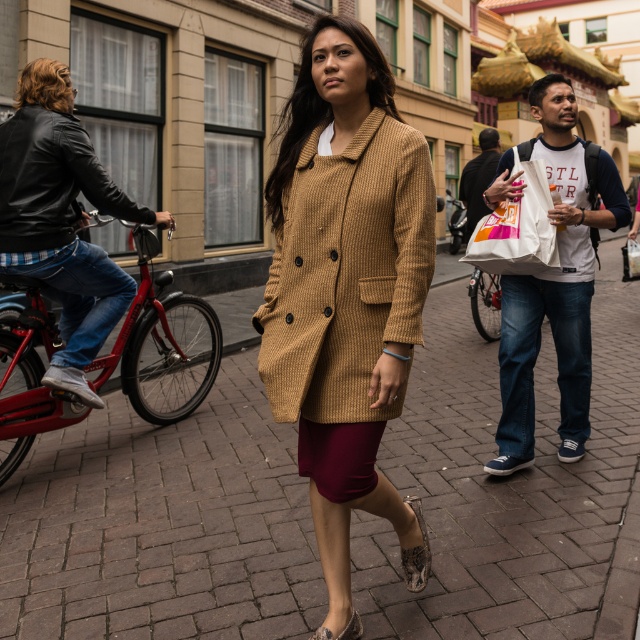
Can you confirm if white cotton tote bag at right is positioned below leather sandal at lower center?

No.

Is white cotton tote bag at right to the left of leather sandal at lower center from the viewer's perspective?

In fact, white cotton tote bag at right is to the right of leather sandal at lower center.

Measure the distance between point (556, 324) and camera.

The distance of point (556, 324) from camera is 13.46 feet.

Where is `white cotton tote bag at right`? The image size is (640, 640). white cotton tote bag at right is located at coordinates (556, 285).

Can you confirm if shiny black bicycle at center is wider than white paper bag at center?

Yes.

Is point (452, 236) positioned after point (634, 272)?

Yes, it is.

Does point (456, 225) come closer to viewer compared to point (636, 276)?

No, (456, 225) is further to viewer.

I want to click on shiny black bicycle at center, so click(x=456, y=224).

Is woven beige coat at center shorter than white cotton t-shirt at center?

No.

Does point (368, 198) come closer to viewer compared to point (486, 157)?

Yes.

Image resolution: width=640 pixels, height=640 pixels. In order to click on woven beige coat at center in this screenshot , I will do `click(346, 272)`.